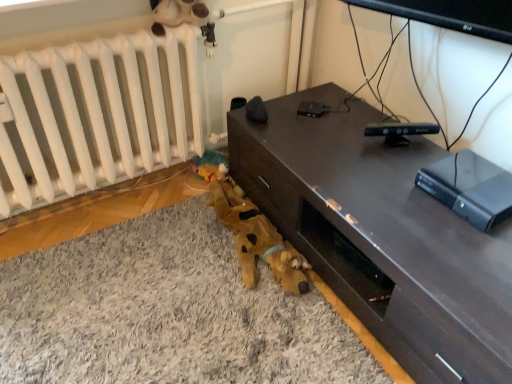
In order to click on vacant space to the left of black plastic remote control at upper center, positioned as the 2th gadget in back-to-front order in this screenshot , I will do `click(347, 140)`.